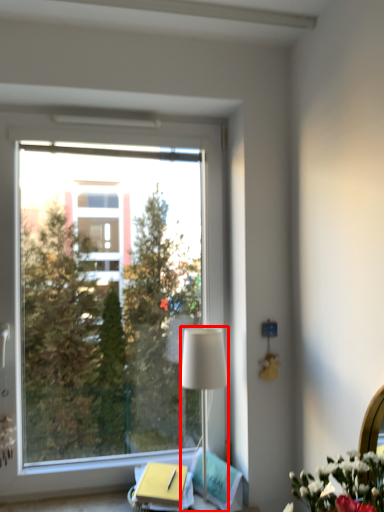
Question: From the image's perspective, what is the correct spatial positioning of lamp (annotated by the red box) in reference to window?

Choices:
 (A) above
 (B) below

Answer: (B)